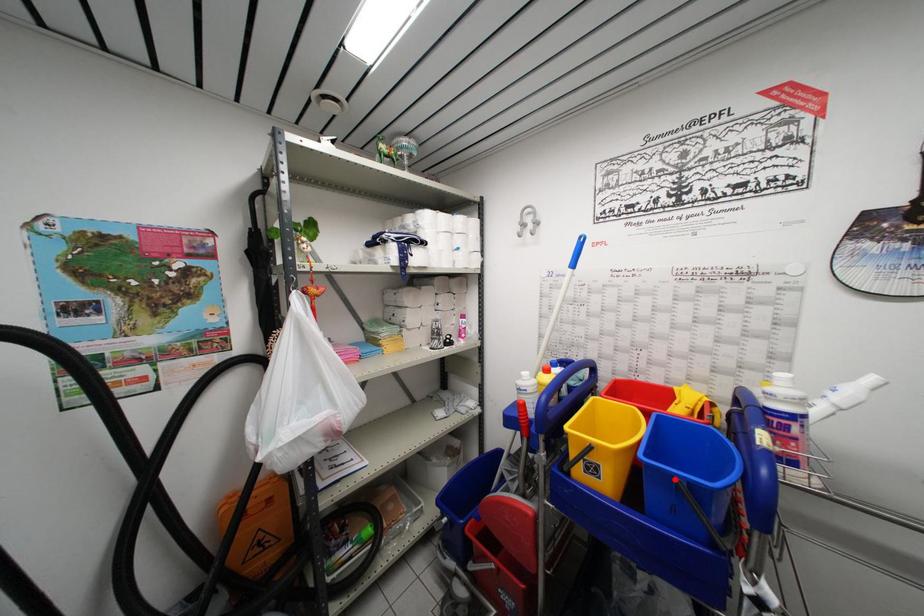
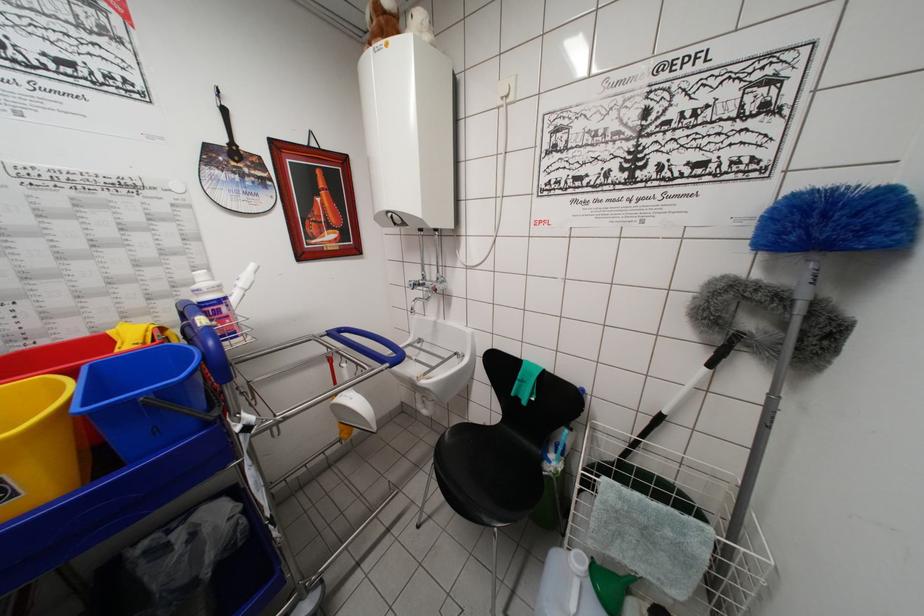
The point at the highlighted location is marked in the first image. Where is the corresponding point in the second image?

(136, 405)